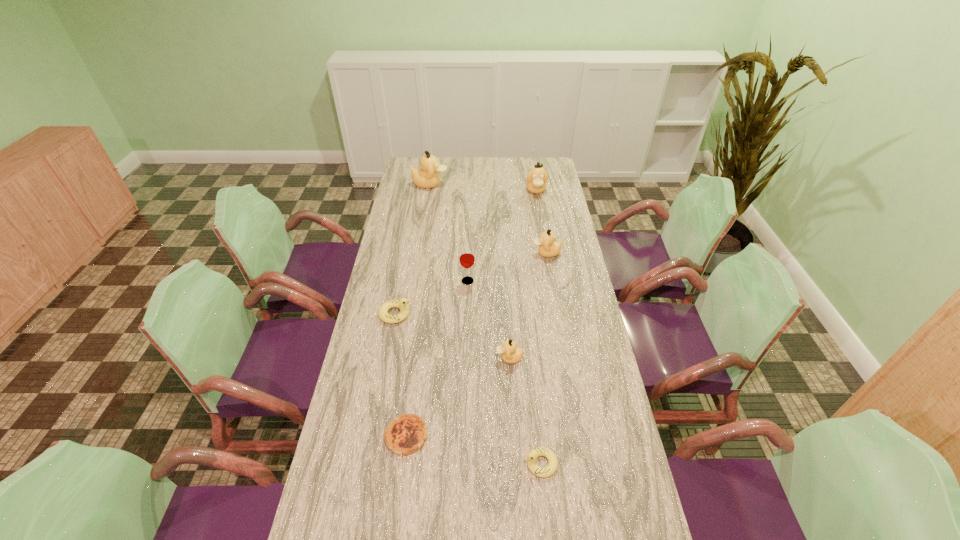
The image size is (960, 540). I want to click on vacant space located on the face of the nearest tan duckling, so click(406, 358).

You are a GUI agent. You are given a task and a screenshot of the screen. Output one action in this format:
    pyautogui.click(x=<x>, y=<y>)
    Task: Click on the vacant region located on the face of the nearest tan duckling
    This screenshot has width=960, height=540.
    Given the screenshot: What is the action you would take?
    pyautogui.click(x=449, y=358)

At what (x,y) coordinates should I click in order to perform the action: click on vacant point located on the face of the nearest tan duckling. Please return your answer as a coordinate pair (x, y). Image resolution: width=960 pixels, height=540 pixels. Looking at the image, I should click on click(x=396, y=358).

Locate an element on the screen. This screenshot has height=540, width=960. free space located 0.380m on the face of the fifth tallest duckling is located at coordinates (519, 314).

At what (x,y) coordinates should I click in order to perform the action: click on vacant space positioned 0.320m on the face of the nearest duckling. Please return your answer as a coordinate pair (x, y). Looking at the image, I should click on pos(404,463).

Where is `free region located 0.140m on the face of the nearest duckling`? This screenshot has height=540, width=960. free region located 0.140m on the face of the nearest duckling is located at coordinates (471, 463).

Locate an element on the screen. free space located 0.120m on the face of the nearest duckling is located at coordinates coord(479,463).

Find the location of a particular element. The width and height of the screenshot is (960, 540). vacant area situated 0.100m on the back of the quiche is located at coordinates (413, 387).

Locate an element on the screen. The width and height of the screenshot is (960, 540). object that is at the far edge is located at coordinates (427, 177).

The image size is (960, 540). I want to click on quiche that is at the left edge, so click(406, 434).